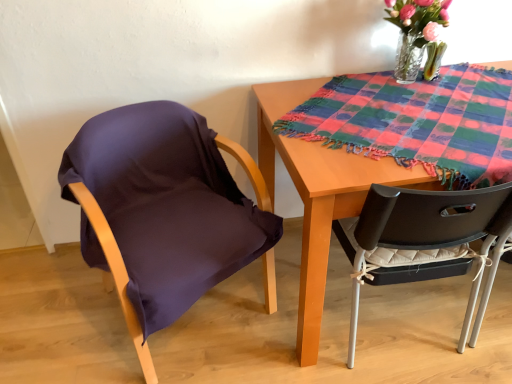
Question: Does multicolored woven cloth at upper right contain wooden table at center?

Choices:
 (A) yes
 (B) no

Answer: (B)

Question: Does multicolored woven cloth at upper right have a lesser width compared to wooden table at center?

Choices:
 (A) no
 (B) yes

Answer: (A)

Question: From the image's perspective, is multicolored woven cloth at upper right on top of wooden table at center?

Choices:
 (A) no
 (B) yes

Answer: (B)

Question: Is multicolored woven cloth at upper right further to camera compared to wooden table at center?

Choices:
 (A) yes
 (B) no

Answer: (A)

Question: Is multicolored woven cloth at upper right oriented away from wooden table at center?

Choices:
 (A) no
 (B) yes

Answer: (A)

Question: From the image's perspective, does multicolored woven cloth at upper right appear lower than wooden table at center?

Choices:
 (A) no
 (B) yes

Answer: (A)

Question: Is the depth of wooden table at center less than that of multicolored woven cloth at upper right?

Choices:
 (A) yes
 (B) no

Answer: (A)

Question: Does wooden table at center come behind multicolored woven cloth at upper right?

Choices:
 (A) no
 (B) yes

Answer: (A)

Question: From the image's perspective, is wooden table at center over multicolored woven cloth at upper right?

Choices:
 (A) yes
 (B) no

Answer: (B)

Question: Does wooden table at center have a smaller size compared to multicolored woven cloth at upper right?

Choices:
 (A) yes
 (B) no

Answer: (B)

Question: Are wooden table at center and multicolored woven cloth at upper right located far from each other?

Choices:
 (A) yes
 (B) no

Answer: (B)

Question: From a real-world perspective, is wooden table at center located higher than multicolored woven cloth at upper right?

Choices:
 (A) yes
 (B) no

Answer: (B)

Question: Is multicolored woven cloth at upper right wider than purple fabric chair at left?

Choices:
 (A) yes
 (B) no

Answer: (A)